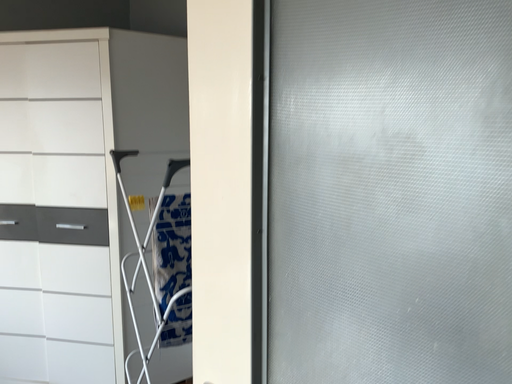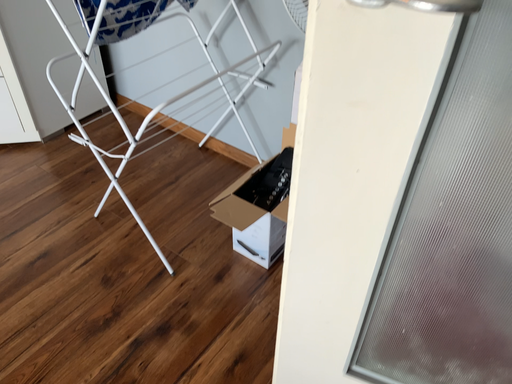
Question: Which way did the camera rotate in the video?

Choices:
 (A) rotated upward
 (B) rotated downward

Answer: (B)